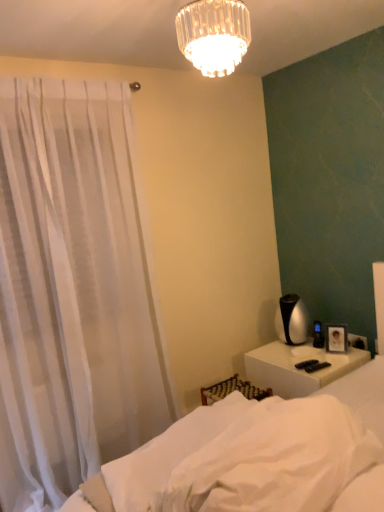
I want to click on free space above white glossy nightstand at lower right (from a real-world perspective), so click(306, 356).